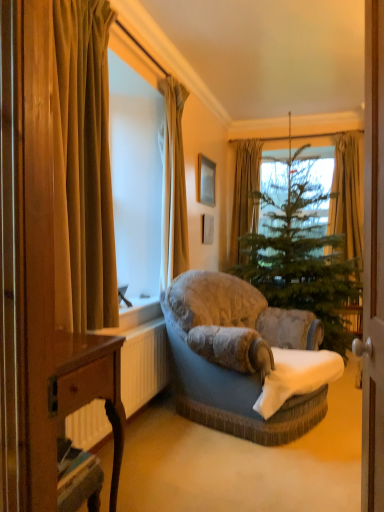
You are a GUI agent. You are given a task and a screenshot of the screen. Output one action in this format:
    pyautogui.click(x=<x>, y=<y>)
    Task: Click on the free spot to the right of white plastic radiator at lower left
    
    Given the screenshot: What is the action you would take?
    pyautogui.click(x=203, y=441)